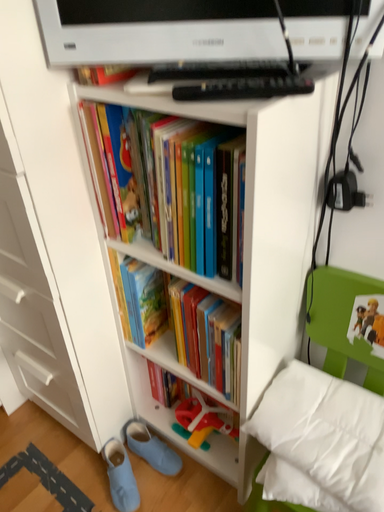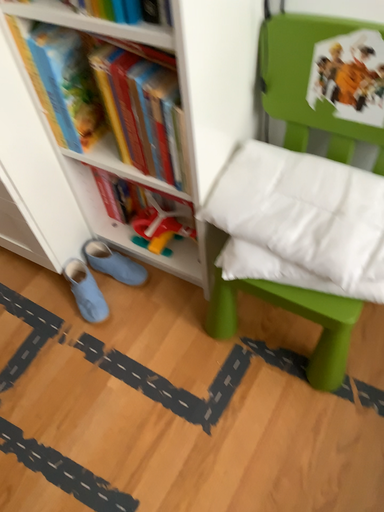
Question: How did the camera likely rotate when shooting the video?

Choices:
 (A) rotated downward
 (B) rotated upward

Answer: (A)